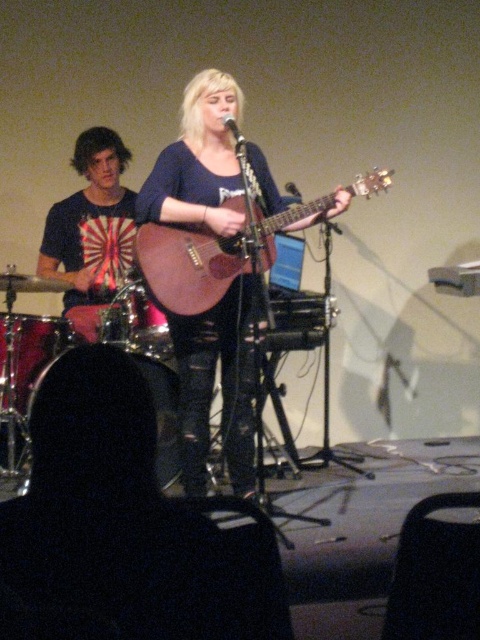
You are a photographer taking a picture of the stage. The wooden acoustic guitar at center and the metallic silver microphone at upper center are both in your frame. Which object is closer to you, the photographer?

The wooden acoustic guitar at center is closer to you because it is further to the viewer than the metallic silver microphone at upper center.

You are a stagehand who needs to adjust the microphone stand to ensure the performer can reach both the wooden acoustic guitar at center and the metallic silver microphone at upper center comfortably. Based on the distance between them, can you confirm if the current spacing allows for easy access without the performer having to stretch too much?

The distance between the wooden acoustic guitar at center and the metallic silver microphone at upper center is 18.10 inches, which is a comfortable reach for most performers, so yes, the current spacing allows for easy access without stretching too much.